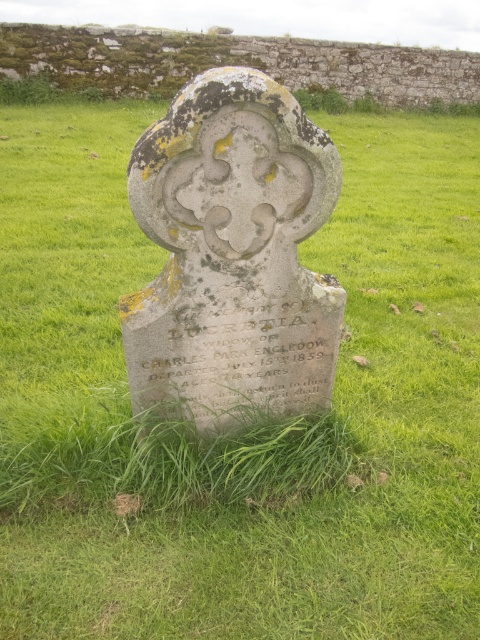
Between gray stone gravestone at center and smooth gray stone at center, which one appears on the left side from the viewer's perspective?

gray stone gravestone at center is more to the left.

Who is taller, gray stone gravestone at center or smooth gray stone at center?

Standing taller between the two is gray stone gravestone at center.

Is point (321, 141) positioned behind point (326, 40)?

That is False.

You are a GUI agent. You are given a task and a screenshot of the screen. Output one action in this format:
    pyautogui.click(x=<x>, y=<y>)
    Task: Click on the gray stone gravestone at center
    
    Given the screenshot: What is the action you would take?
    pyautogui.click(x=232, y=253)